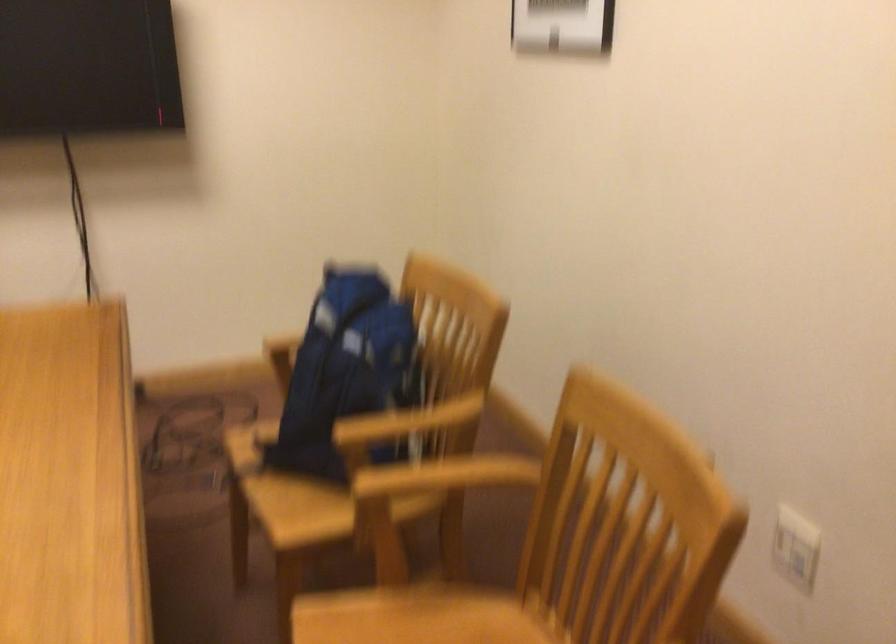
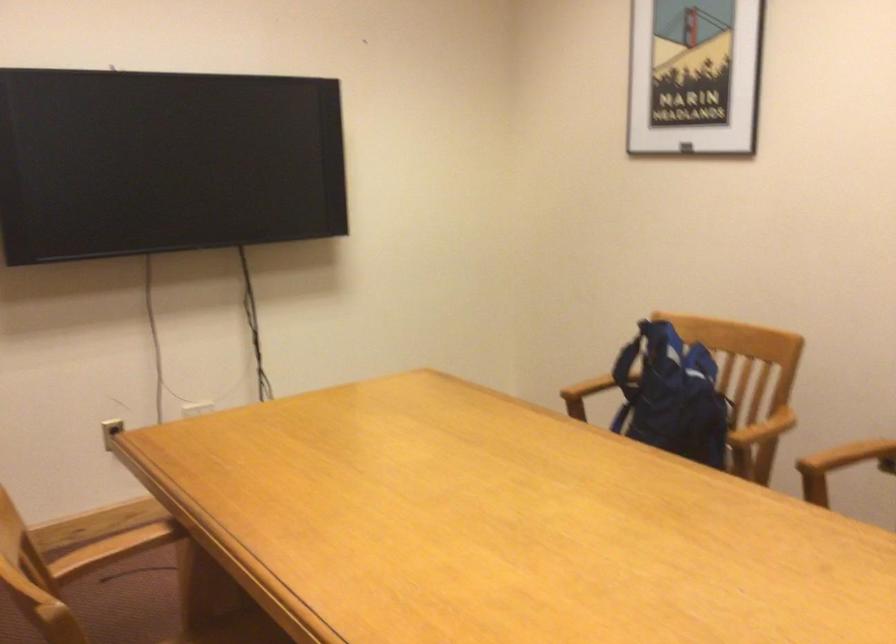
Question: In a continuous first-person perspective shot, in which direction is the camera moving?

Choices:
 (A) Left
 (B) Right
 (C) Forward
 (D) Backward

Answer: (A)